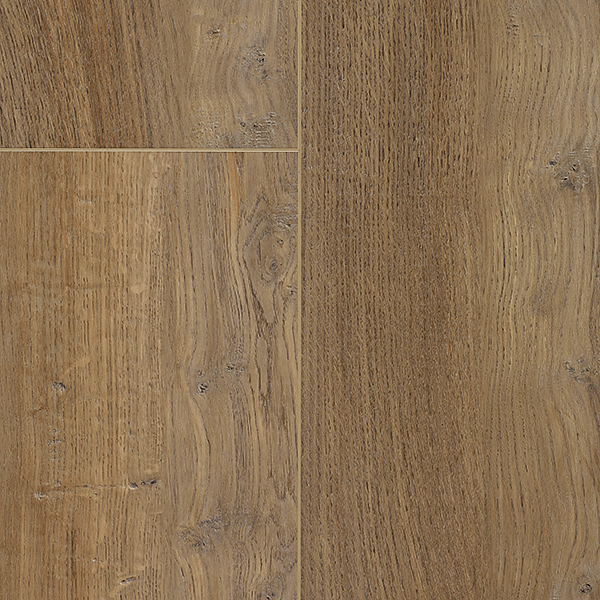
Where is `wood grain lines`? This screenshot has height=600, width=600. wood grain lines is located at coordinates (251, 234), (275, 222), (273, 291), (264, 322), (250, 280), (257, 339), (259, 390), (270, 387).